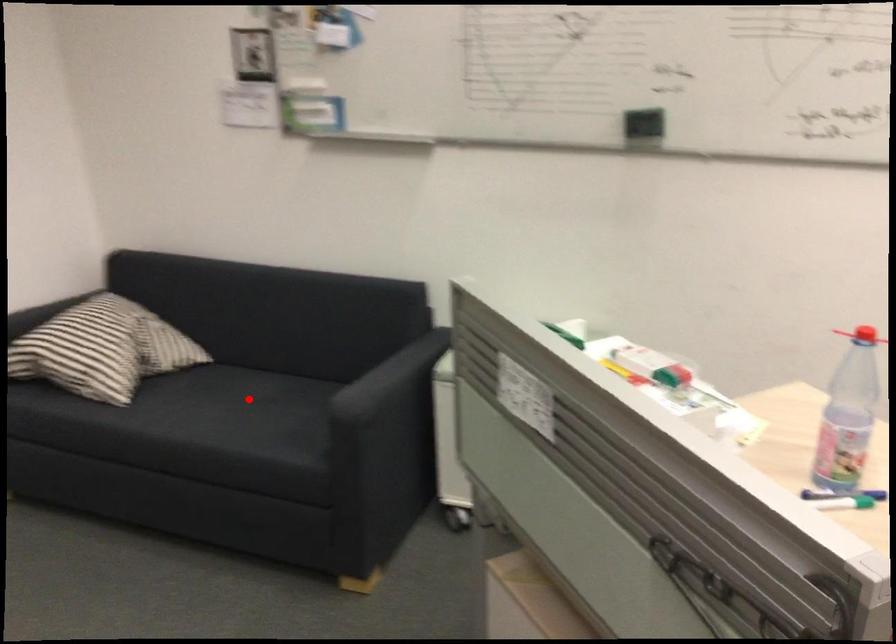
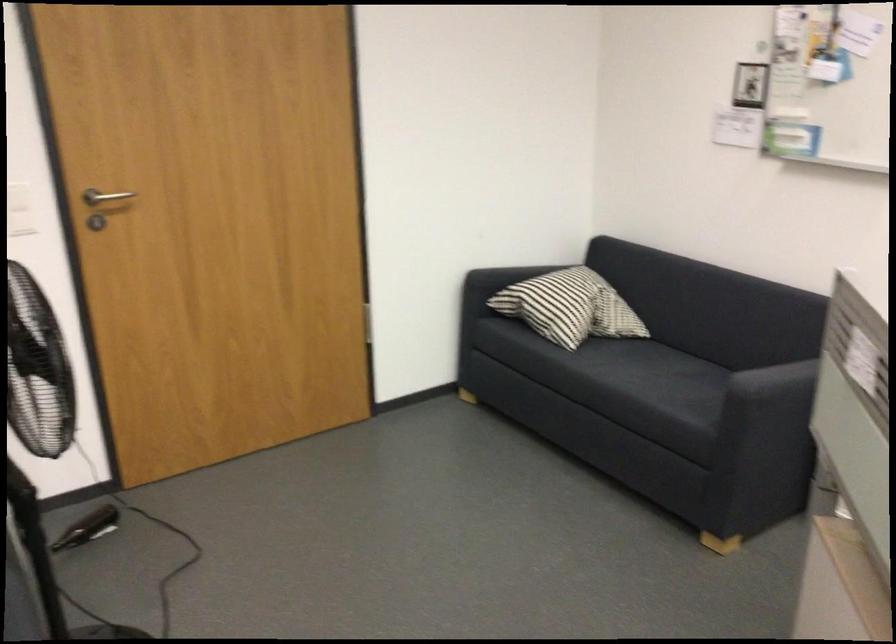
Find the pixel in the second image that matches the highlighted location in the first image.

(668, 370)